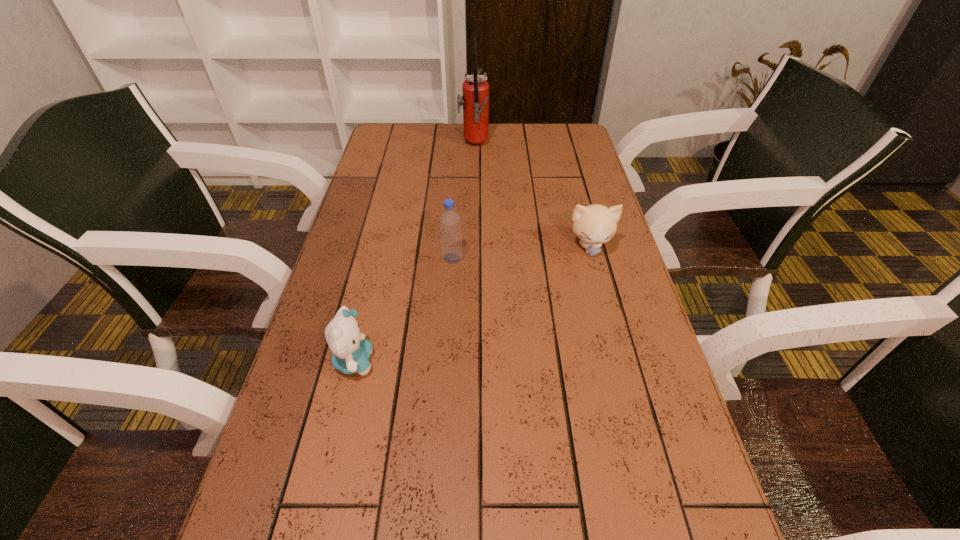
At what (x,y) coordinates should I click in order to perform the action: click on free location located 0.370m on the face of the nearest object. Please return your answer as a coordinate pair (x, y). The width and height of the screenshot is (960, 540). Looking at the image, I should click on (552, 362).

The height and width of the screenshot is (540, 960). What are the coordinates of `object that is at the far edge` in the screenshot? It's located at (475, 100).

Where is `object situated at the left edge`? object situated at the left edge is located at coordinates (351, 351).

Identify the location of object positioned at the right edge. The height and width of the screenshot is (540, 960). (595, 224).

The image size is (960, 540). In the image, there is a desktop. What are the coordinates of `free space at the far edge` in the screenshot? It's located at (462, 125).

In the image, there is a desktop. At what (x,y) coordinates should I click in order to perform the action: click on free region at the left edge. Please return your answer as a coordinate pair (x, y). Looking at the image, I should click on (395, 179).

In the image, there is a desktop. At what (x,y) coordinates should I click in order to perform the action: click on vacant space at the right edge. Please return your answer as a coordinate pair (x, y). Looking at the image, I should click on (586, 289).

I want to click on free spot at the far right corner of the desktop, so click(555, 132).

This screenshot has width=960, height=540. What are the coordinates of `vacant area that lies between the rightmost object and the third shortest object` in the screenshot? It's located at (521, 253).

You are a GUI agent. You are given a task and a screenshot of the screen. Output one action in this format:
    pyautogui.click(x=<x>, y=<y>)
    Task: Click on the free space that is in between the leftmost object and the fire extinguisher
    This screenshot has height=540, width=960.
    Given the screenshot: What is the action you would take?
    pyautogui.click(x=414, y=253)